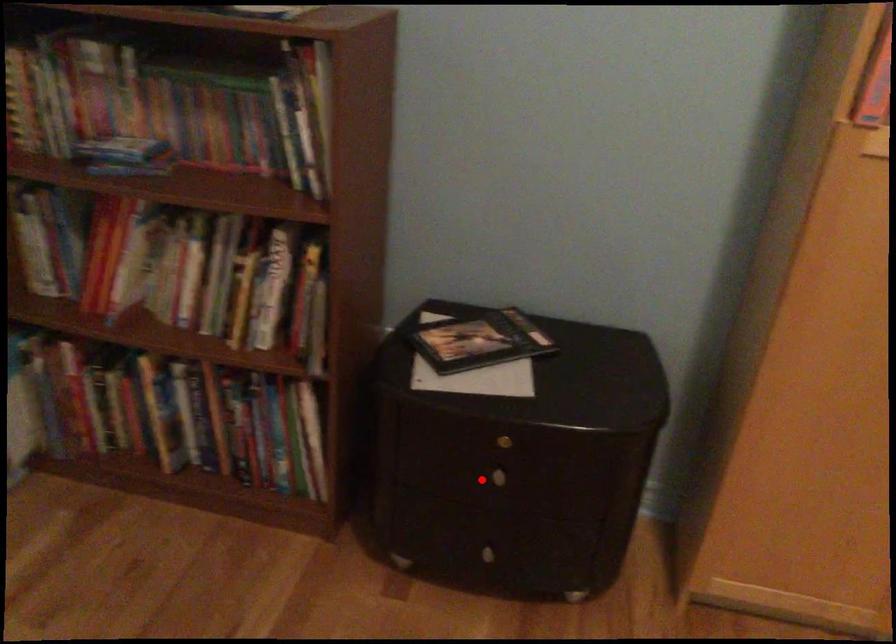
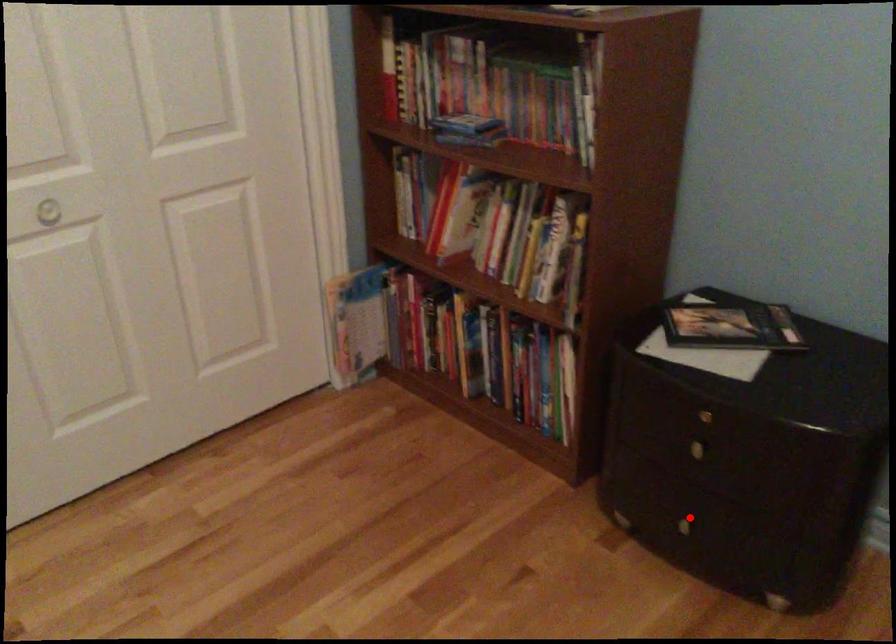
I am providing you with two images of the same scene from different viewpoints. A red point is marked on the first image and another point is marked on the second image. Is the red point in image1 aligned with the point shown in image2?

No